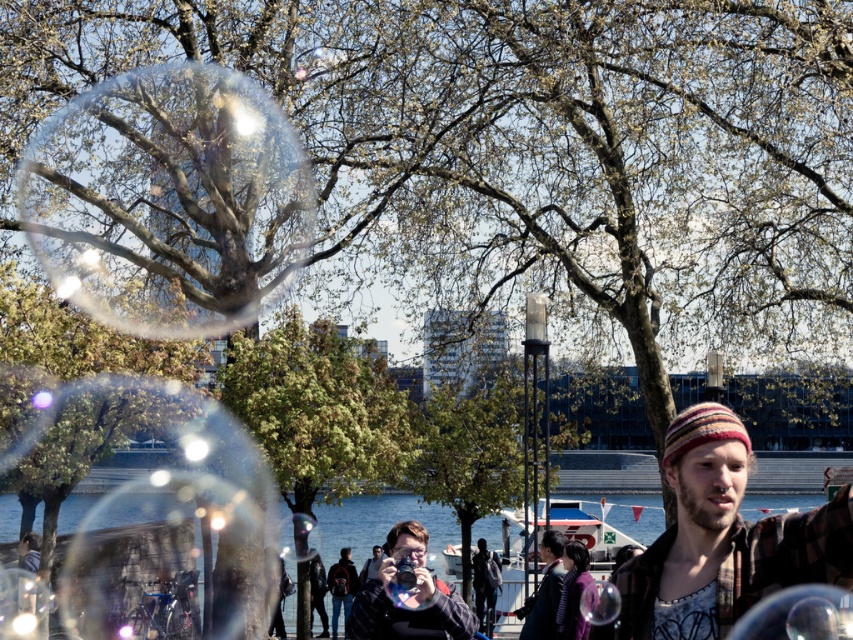
You are standing at the riverside park and want to take a photo of the two points marked in the scene. Which point, point (83, 208) or point (851, 557), is closer to your camera when you take the picture?

Point (83, 208) is closer to the camera than point (851, 557) because it is further to the camera than the other point.

You are standing at the camera position and want to throw a pebble to reach the plaid flannel shirt at right. If your throwing range is 10 meters, will you be able to reach it?

The plaid flannel shirt at right is 11.19 meters away from the camera, which exceeds your throwing range of 10 meters. You won not be able to reach it.

You are a photographer setting up your equipment at the riverside park. You have a plaid flannel shirt at right and a matte black camera at center. Which object is closer to the ground?

The plaid flail shirt at right is shorter than the matte black camera at center, so the plaid flannel shirt at right is closer to the ground.